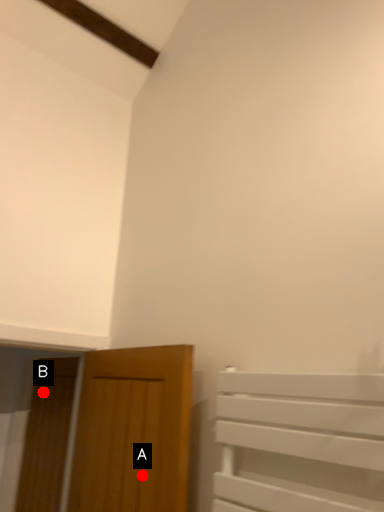
Question: Two points are circled on the image, labeled by A and B beside each circle. Which point is further to the camera?

Choices:
 (A) A is further
 (B) B is further

Answer: (B)